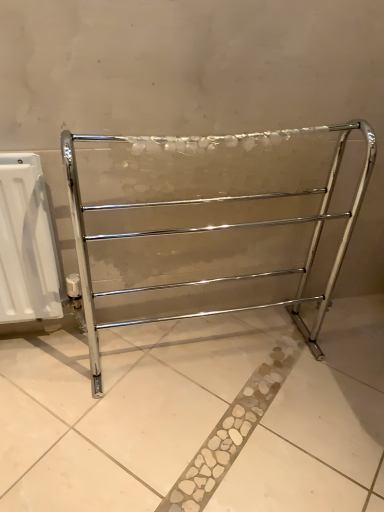
Question: Is the position of polished chrome towel rack at center less distant than that of white plastic radiator at left?

Choices:
 (A) yes
 (B) no

Answer: (A)

Question: Is polished chrome towel rack at center far from white plastic radiator at left?

Choices:
 (A) no
 (B) yes

Answer: (A)

Question: From a real-world perspective, is polished chrome towel rack at center below white plastic radiator at left?

Choices:
 (A) no
 (B) yes

Answer: (A)

Question: Does polished chrome towel rack at center have a greater width compared to white plastic radiator at left?

Choices:
 (A) yes
 (B) no

Answer: (A)

Question: Considering the relative sizes of polished chrome towel rack at center and white plastic radiator at left in the image provided, is polished chrome towel rack at center smaller than white plastic radiator at left?

Choices:
 (A) no
 (B) yes

Answer: (A)

Question: From the image's perspective, is polished chrome towel rack at center over white plastic radiator at left?

Choices:
 (A) yes
 (B) no

Answer: (A)

Question: Is white plastic radiator at left facing towards polished chrome towel rack at center?

Choices:
 (A) no
 (B) yes

Answer: (A)

Question: Considering the relative sizes of white plastic radiator at left and polished chrome towel rack at center in the image provided, is white plastic radiator at left taller than polished chrome towel rack at center?

Choices:
 (A) yes
 (B) no

Answer: (B)

Question: Is white plastic radiator at left to the left of polished chrome towel rack at center from the viewer's perspective?

Choices:
 (A) yes
 (B) no

Answer: (A)

Question: Considering the relative positions of white plastic radiator at left and polished chrome towel rack at center in the image provided, is white plastic radiator at left behind polished chrome towel rack at center?

Choices:
 (A) yes
 (B) no

Answer: (A)

Question: Is white plastic radiator at left positioned beyond the bounds of polished chrome towel rack at center?

Choices:
 (A) no
 (B) yes

Answer: (B)

Question: From the image's perspective, is white plastic radiator at left over polished chrome towel rack at center?

Choices:
 (A) no
 (B) yes

Answer: (A)

Question: Considering the positions of point (29, 316) and point (345, 234), is point (29, 316) closer or farther from the camera than point (345, 234)?

Choices:
 (A) closer
 (B) farther

Answer: (A)